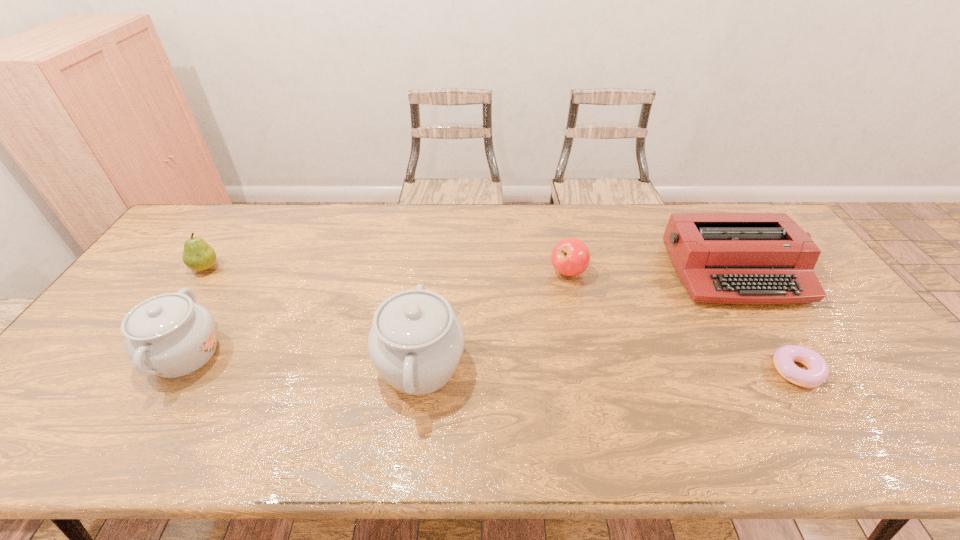
Image resolution: width=960 pixels, height=540 pixels. Find the location of `free location located 0.050m on the front of the pear`. free location located 0.050m on the front of the pear is located at coordinates (191, 289).

Where is `blank space located on the typing side of the typewriter`? The height and width of the screenshot is (540, 960). blank space located on the typing side of the typewriter is located at coordinates (767, 325).

Locate an element on the screen. This screenshot has width=960, height=540. vacant space located on the front of the third object from right to left is located at coordinates (587, 359).

This screenshot has height=540, width=960. I want to click on vacant position located on the left of the doughnut, so click(688, 371).

You are a GUI agent. You are given a task and a screenshot of the screen. Output one action in this format:
    pyautogui.click(x=<x>, y=<y>)
    Task: Click on the object at the far edge
    This screenshot has height=540, width=960.
    Given the screenshot: What is the action you would take?
    pyautogui.click(x=728, y=258)

Locate an element on the screen. doughnut that is positioned at the near edge is located at coordinates (784, 357).

Locate an element on the screen. object located at the left edge is located at coordinates (198, 255).

The height and width of the screenshot is (540, 960). In order to click on object at the right edge in this screenshot , I will do `click(728, 258)`.

Find the location of a particular element. The height and width of the screenshot is (540, 960). object situated at the far right corner is located at coordinates (728, 258).

In the image, there is a desktop. Where is `free space at the far edge`? free space at the far edge is located at coordinates (338, 220).